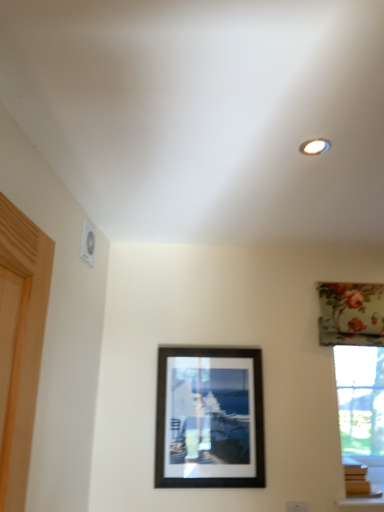
Question: From a real-world perspective, does floral fabric curtain at upper right sit lower than black matte picture frame at center?

Choices:
 (A) no
 (B) yes

Answer: (A)

Question: Does floral fabric curtain at upper right appear on the left side of black matte picture frame at center?

Choices:
 (A) yes
 (B) no

Answer: (B)

Question: Is floral fabric curtain at upper right looking in the opposite direction of black matte picture frame at center?

Choices:
 (A) yes
 (B) no

Answer: (B)

Question: Is floral fabric curtain at upper right not within black matte picture frame at center?

Choices:
 (A) yes
 (B) no

Answer: (A)

Question: Is floral fabric curtain at upper right beside black matte picture frame at center?

Choices:
 (A) yes
 (B) no

Answer: (B)

Question: From the image's perspective, is floral fabric curtain at upper right over black matte picture frame at center?

Choices:
 (A) no
 (B) yes

Answer: (B)

Question: Does black matte picture frame at center have a larger size compared to floral fabric curtain at upper right?

Choices:
 (A) no
 (B) yes

Answer: (B)

Question: Considering the relative positions of black matte picture frame at center and floral fabric curtain at upper right in the image provided, is black matte picture frame at center to the right of floral fabric curtain at upper right from the viewer's perspective?

Choices:
 (A) no
 (B) yes

Answer: (A)

Question: Is black matte picture frame at center further to camera compared to floral fabric curtain at upper right?

Choices:
 (A) no
 (B) yes

Answer: (A)

Question: Is black matte picture frame at center turned away from floral fabric curtain at upper right?

Choices:
 (A) yes
 (B) no

Answer: (B)

Question: From a real-world perspective, is black matte picture frame at center positioned under floral fabric curtain at upper right based on gravity?

Choices:
 (A) yes
 (B) no

Answer: (A)

Question: Are black matte picture frame at center and floral fabric curtain at upper right making contact?

Choices:
 (A) no
 (B) yes

Answer: (A)

Question: Considering the positions of floral fabric curtain at upper right and black matte picture frame at center in the image, is floral fabric curtain at upper right taller or shorter than black matte picture frame at center?

Choices:
 (A) short
 (B) tall

Answer: (A)